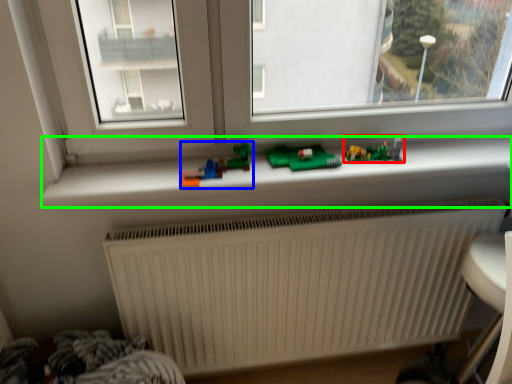
Question: Which is farther away from toy (highlighted by a red box)? toy (highlighted by a blue box) or window sill (highlighted by a green box)?

Choices:
 (A) toy
 (B) window sill

Answer: (A)